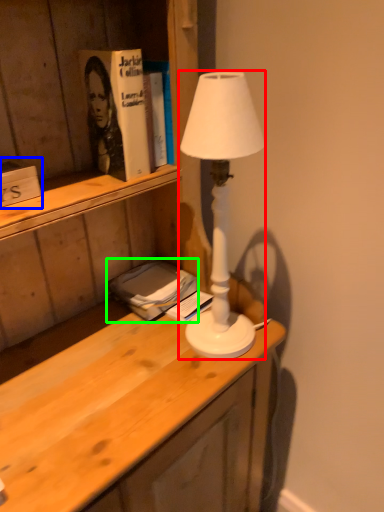
Question: Considering the real-world distances, which object is farthest from lamp (highlighted by a red box)? book (highlighted by a blue box) or book (highlighted by a green box)?

Choices:
 (A) book
 (B) book

Answer: (A)